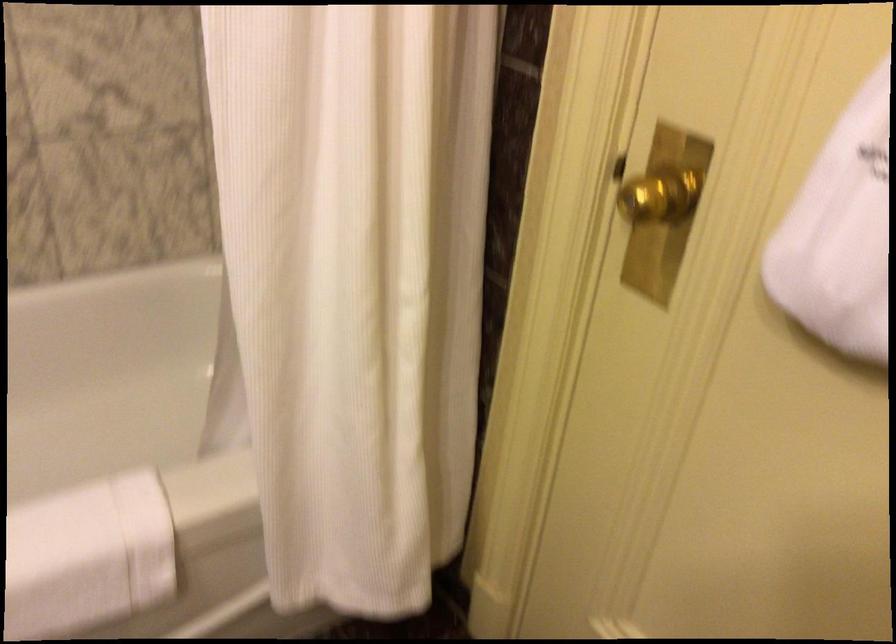
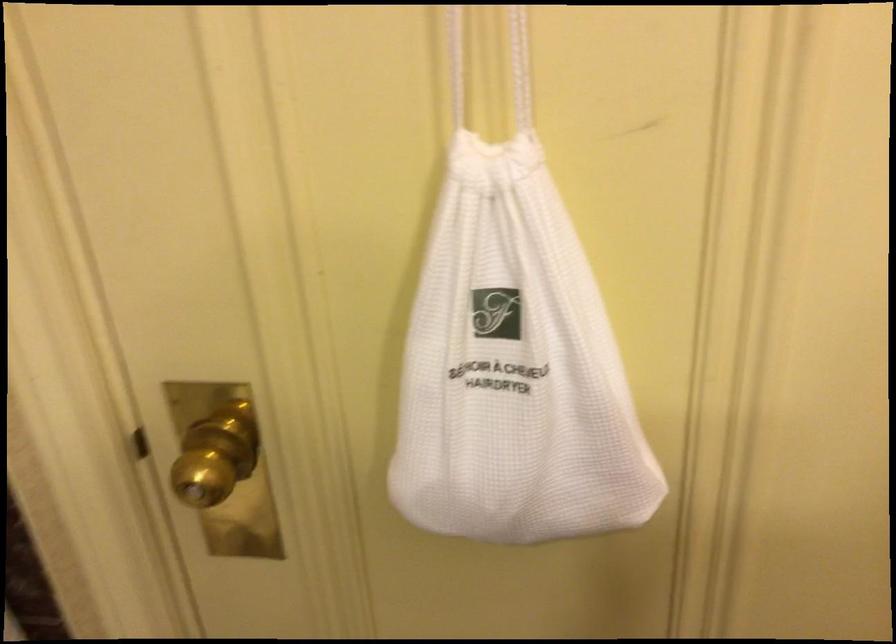
Find the pixel in the second image that matches the point at 660,187 in the first image.

(216, 456)